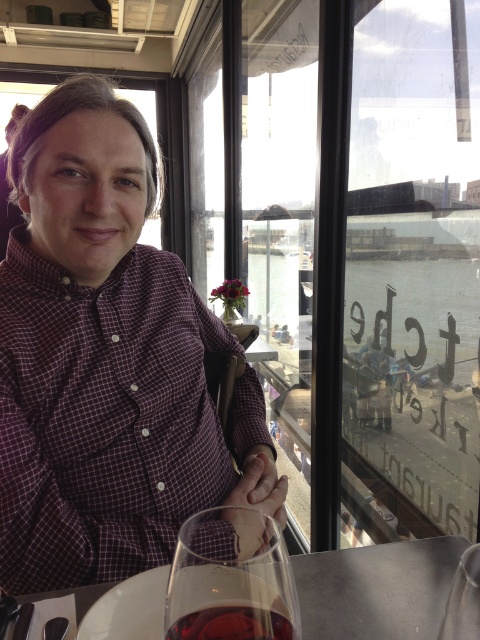
You are a waiter in a restaurant and need to place a dessert plate on the table. The dessert plate is 10 inches in diameter. Can you place it on the white glossy table at center without it overlapping the purple checkered shirt at center?

The purple checkered shirt at center is further to the viewer than the white glossy table at center, meaning the shirt is closer to you. Since the shirt is closer, placing the dessert plate on the table won

You are a delivery robot navigating through a restaurant. You need to move from point A at point (81, 595) to point B at point (263, 560). According to the scene description, which point is closer to the large windows overlooking the waterfront?

Point (263, 560) is closer to the large windows overlooking the waterfront because it is in front of point (81, 595), which is behind it.